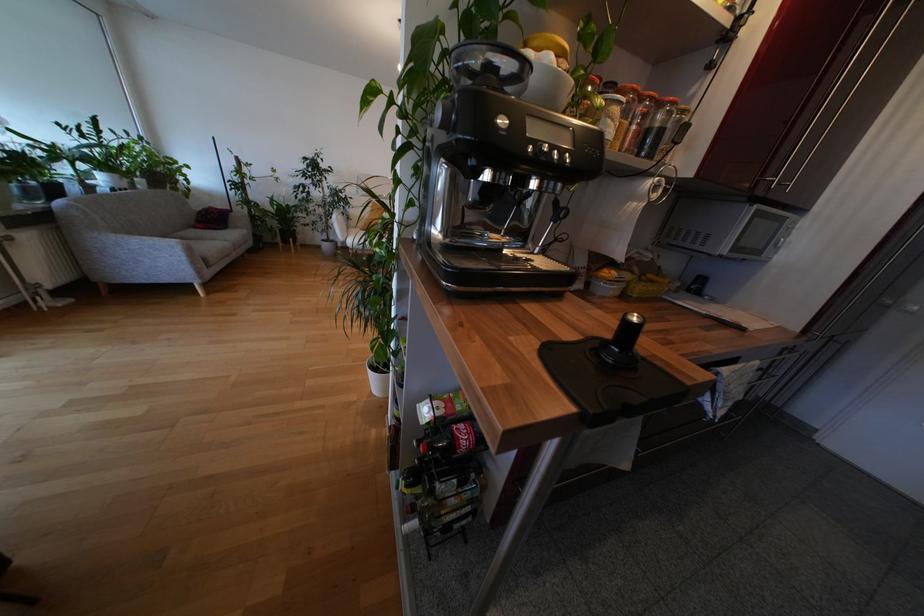
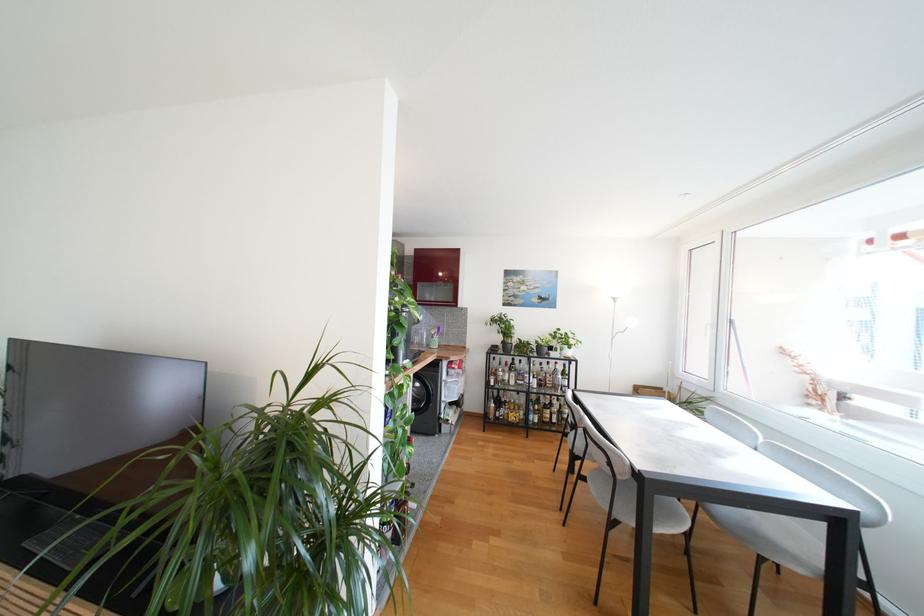
Question: I am providing you with two images of the same scene from different viewpoints. Please identify which objects are invisible in image2.

Choices:
 (A) white window handle
 (B) orange jar lid
 (C) black machine knob
 (D) glass bottle

Answer: (B)